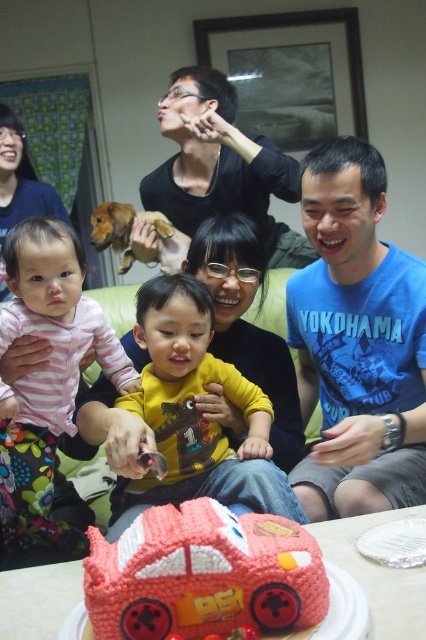
You are a photographer at the birthday party and want to take a photo of the smooth red car at center and the striped fabric baby at left. Which object should you focus on first if you want to capture both in one shot without moving the camera?

The smooth red car at center is below striped fabric baby at left, so you should focus on the striped fabric baby at left first since it is closer to the camera and then adjust to capture the smooth red car at center in the same frame.

You are standing in the room and want to reach both the point at coordinates (354, 456) and the point at coordinates (288, 500). Which point will you reach first?

You will reach point (354, 456) first because it is closer to you than point (288, 500).